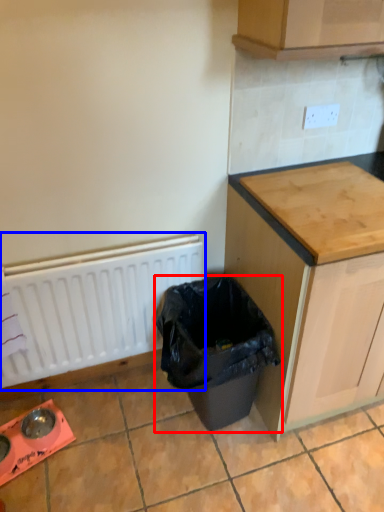
Question: Which object appears farthest to the camera in this image, waste container (highlighted by a red box) or radiator (highlighted by a blue box)?

Choices:
 (A) waste container
 (B) radiator

Answer: (B)